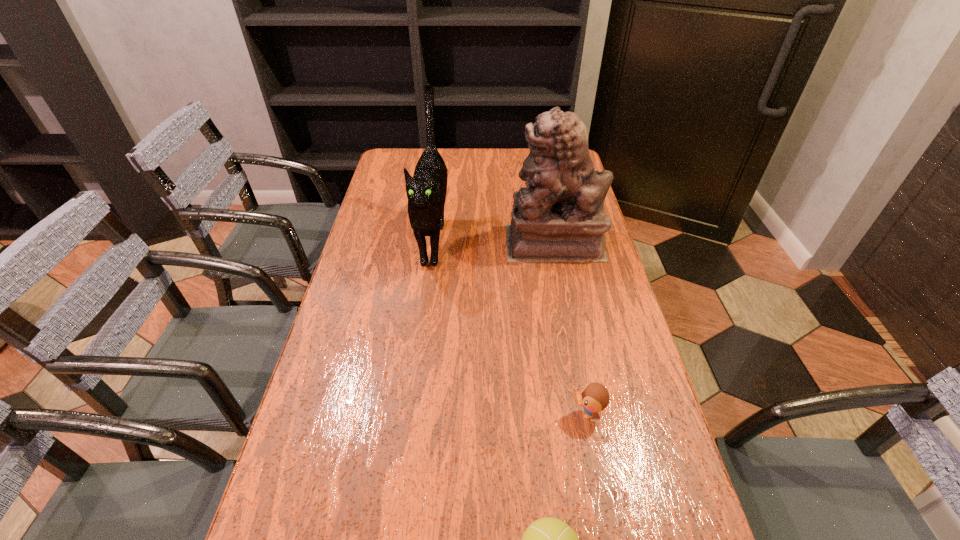
At what (x,y) coordinates should I click in order to perform the action: click on sculpture that is at the right edge. Please return your answer as a coordinate pair (x, y). Image resolution: width=960 pixels, height=540 pixels. Looking at the image, I should click on (559, 217).

The height and width of the screenshot is (540, 960). What are the coordinates of `duck situated at the right edge` in the screenshot? It's located at (x=594, y=397).

Identify the location of vacant space at the left edge of the desktop. (396, 232).

Find the location of `vacant region at the right edge of the desktop`. vacant region at the right edge of the desktop is located at coordinates (634, 346).

The height and width of the screenshot is (540, 960). I want to click on blank area at the far left corner, so pos(406,165).

Identify the location of free spot between the sculpture and the cat. point(493,240).

Locate an element on the screen. The image size is (960, 540). vacant space in between the second nearest object and the sculpture is located at coordinates (570, 328).

Image resolution: width=960 pixels, height=540 pixels. I want to click on object that is the third nearest to the sculpture, so click(x=548, y=539).

This screenshot has width=960, height=540. In order to click on object that stands as the closest to the second nearest object in this screenshot , I will do `click(548, 539)`.